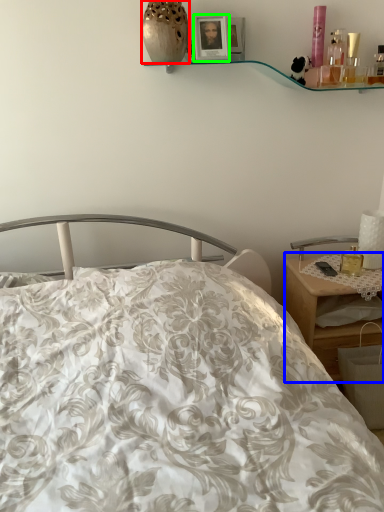
Question: Which is nearer to the vase (highlighted by a red box)? desk (highlighted by a blue box) or picture frame (highlighted by a green box).

Choices:
 (A) desk
 (B) picture frame

Answer: (B)